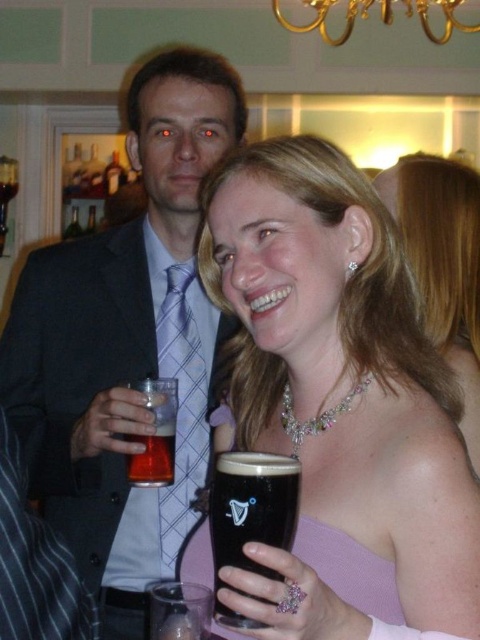
Can you confirm if satin gold necklace at upper center is positioned to the left of pearl/sparkling necklace at center?

In fact, satin gold necklace at upper center is to the right of pearl/sparkling necklace at center.

This screenshot has height=640, width=480. Describe the element at coordinates (444, 262) in the screenshot. I see `satin gold necklace at upper center` at that location.

Describe the element at coordinates (444, 262) in the screenshot. The width and height of the screenshot is (480, 640). I see `satin gold necklace at upper center` at that location.

Where is `satin gold necklace at upper center`? satin gold necklace at upper center is located at coordinates (444, 262).

Looking at this image, is matte purple tie at left further to camera compared to pearl/sparkling necklace at center?

That is True.

Describe the element at coordinates (126, 342) in the screenshot. I see `matte purple tie at left` at that location.

Between point (231, 140) and point (321, 429), which one is positioned in front?

Point (321, 429) is in front.

Find the location of a particular element. matte purple tie at left is located at coordinates (126, 342).

Is matte purple tie at left above satin gold necklace at upper center?

Actually, matte purple tie at left is below satin gold necklace at upper center.

Which of these two, matte purple tie at left or satin gold necklace at upper center, stands shorter?

With less height is satin gold necklace at upper center.

Between point (118, 525) and point (445, 349), which one is positioned in front?

Point (445, 349) is in front.

This screenshot has height=640, width=480. What are the coordinates of `matte purple tie at left` in the screenshot? It's located at (126, 342).